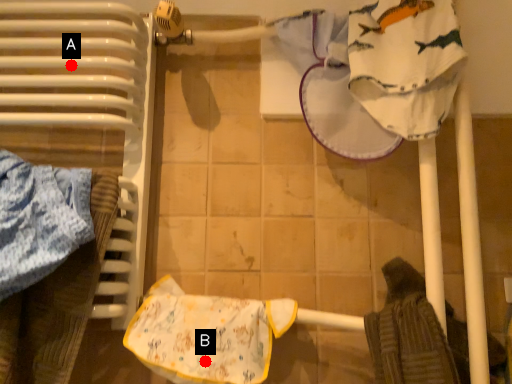
Question: Two points are circled on the image, labeled by A and B beside each circle. Which point is further to the camera?

Choices:
 (A) A is further
 (B) B is further

Answer: (A)